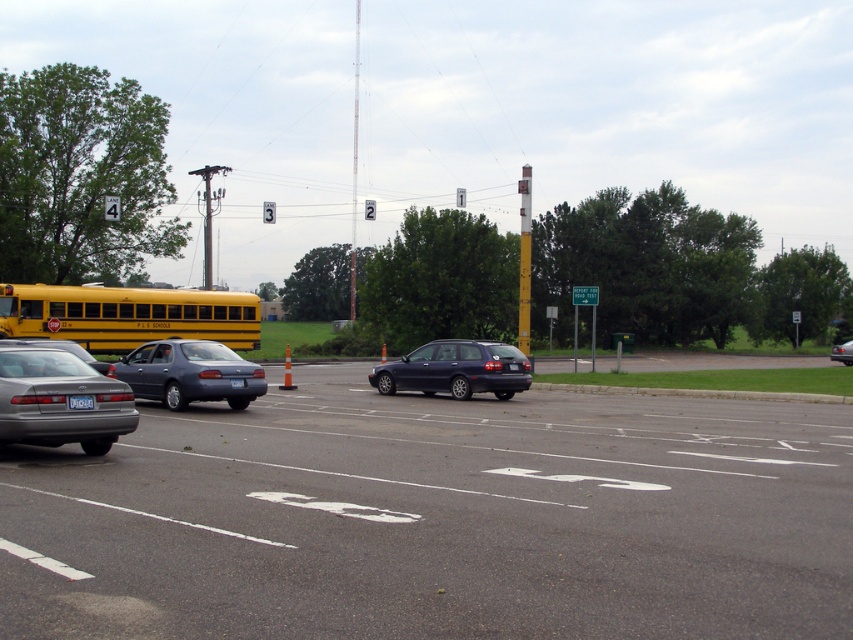
You are a delivery driver who needs to park your truck in the parking lot. The truck requires a space that is at least twice as large as the metallic silver sedan at center. Can the dark gray asphalt parking lot at lower left accommodate your truck?

The dark gray asphalt parking lot at lower left has a larger size compared to the metallic silver sedan at center. However, the description only states that the parking lot is larger, but it does not specify if it is at least twice the size of the sedan. Therefore, it is uncertain whether the parking lot at lower left can accommodate a truck requiring double the sedan size.

You are a delivery driver who needs to park your truck in the parking lot. You see the dark gray asphalt parking lot at lower left and the matte gray sedan at center. Which area is more suitable for parking your truck?

The dark gray asphalt parking lot at lower left is shorter than the matte gray sedan at center, so it might not be suitable for a truck. The matte gray sedan at center is taller, indicating the parking space there is larger and more appropriate for a truck.